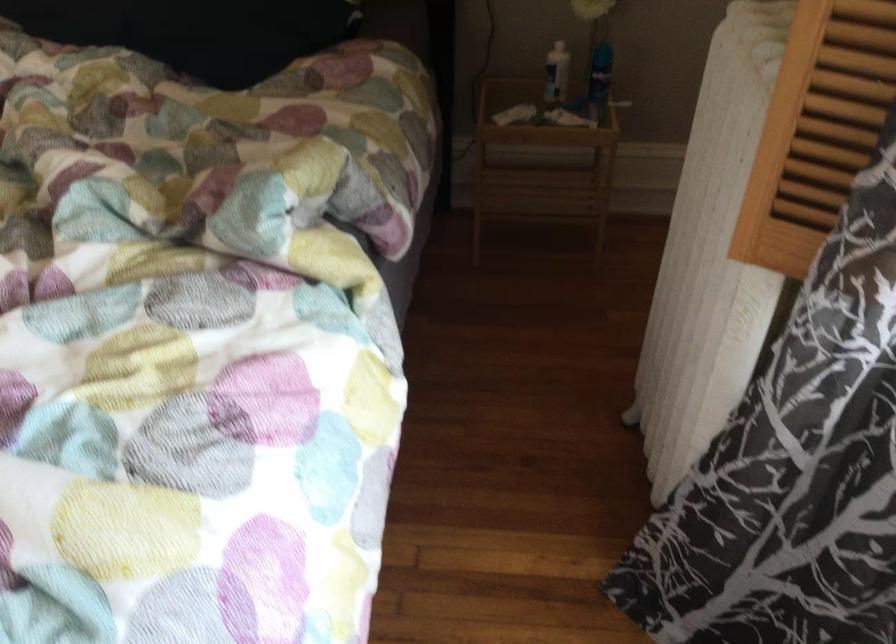
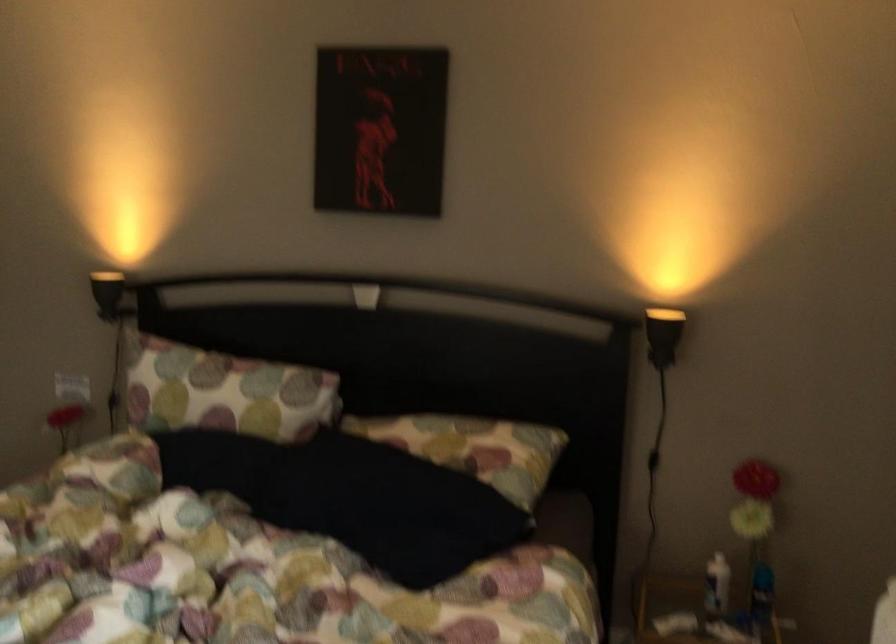
Question: Based on the continuous images, in which direction is the camera rotating? Reply with the corresponding letter.

Choices:
 (A) Left
 (B) Right
 (C) Up
 (D) Down

Answer: (C)